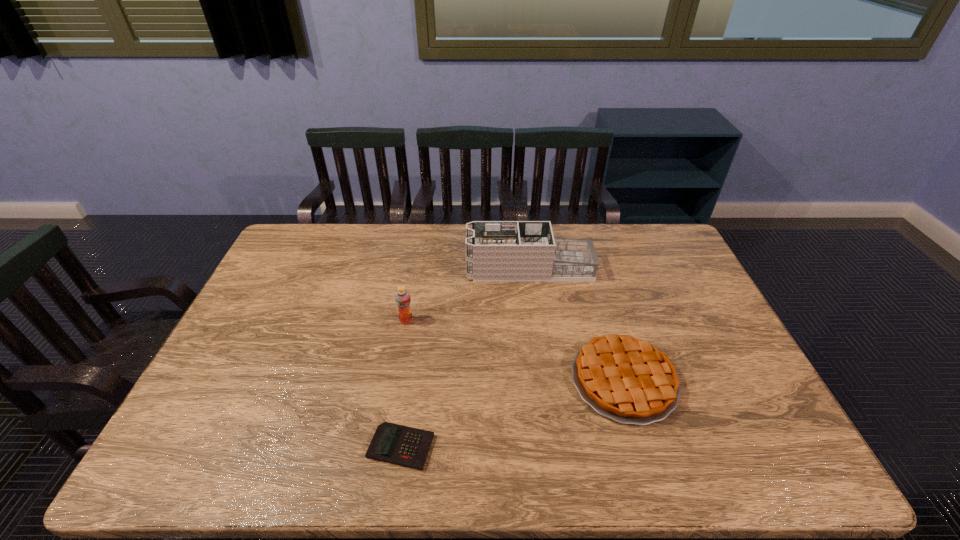
Where is `empty location between the third nearest object and the shortest object`? Image resolution: width=960 pixels, height=540 pixels. empty location between the third nearest object and the shortest object is located at coordinates (403, 384).

At what (x,y) coordinates should I click in order to perform the action: click on empty space that is in between the calculator and the third tallest object. Please return your answer as a coordinate pair (x, y). The image size is (960, 540). Looking at the image, I should click on (513, 414).

This screenshot has height=540, width=960. Identify the location of blank region between the second shortest object and the shortest object. (513, 414).

The image size is (960, 540). What are the coordinates of `free spot between the third nearest object and the shortest object` in the screenshot? It's located at (403, 384).

Locate an element on the screen. vacant area that lies between the farthest object and the shortest object is located at coordinates (465, 358).

The image size is (960, 540). What are the coordinates of `free space that is in between the dollhouse and the calculator` in the screenshot? It's located at (465, 358).

Identify the location of vacant area between the shortest object and the dollhouse. This screenshot has width=960, height=540. (465, 358).

Point out which object is positioned as the third nearest to the shortest object. Please provide its 2D coordinates. Your answer should be formatted as a tuple, i.e. [(x, y)], where the tuple contains the x and y coordinates of a point satisfying the conditions above.

[(496, 251)]

Identify which object is the closest to the dollhouse. Please provide its 2D coordinates. Your answer should be formatted as a tuple, i.e. [(x, y)], where the tuple contains the x and y coordinates of a point satisfying the conditions above.

[(402, 297)]

At what (x,y) coordinates should I click in order to perform the action: click on free space that satisfies the following two spatial constraints: 1. on the front side of the orange juice; 2. on the right side of the calculator. Please return your answer as a coordinate pair (x, y). The height and width of the screenshot is (540, 960). Looking at the image, I should click on (384, 447).